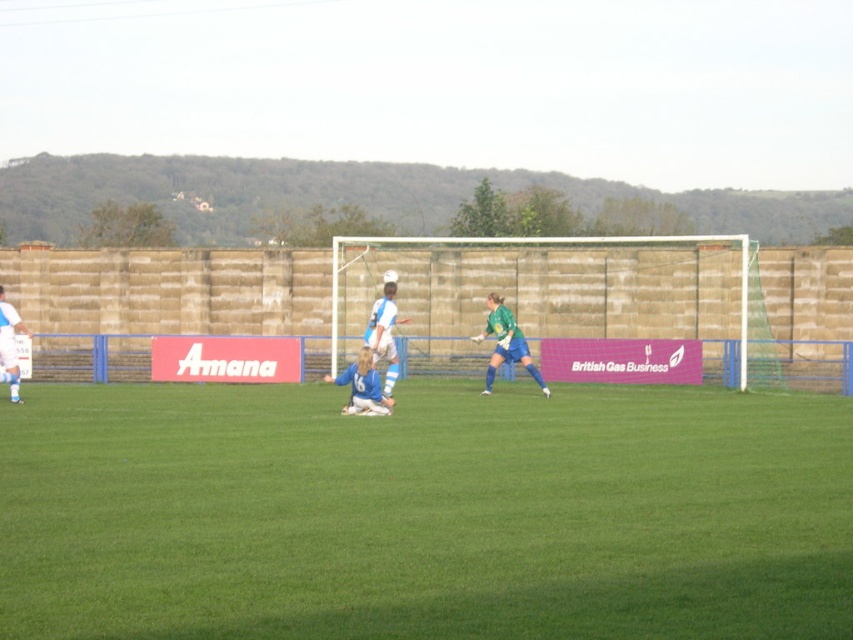
Question: Considering the relative positions of white net at center and white matte soccer ball at center in the image provided, where is white net at center located with respect to white matte soccer ball at center?

Choices:
 (A) above
 (B) below

Answer: (A)

Question: Among these objects, which one is nearest to the camera?

Choices:
 (A) white jersey at center
 (B) blue jersey at center
 (C) white net at center

Answer: (B)

Question: Considering the relative positions of green grass at center and white matte soccer ball at center in the image provided, where is green grass at center located with respect to white matte soccer ball at center?

Choices:
 (A) left
 (B) right

Answer: (B)

Question: Estimate the real-world distances between objects in this image. Which object is closer to the white net at center?

Choices:
 (A) green grass at center
 (B) white matte soccer ball at center
 (C) white jersey at center
 (D) blue jersey at center

Answer: (A)

Question: Which object is the closest to the white net at center?

Choices:
 (A) white matte soccer ball at center
 (B) green grass at center

Answer: (B)

Question: Can you confirm if green grass at center is wider than white net at center?

Choices:
 (A) no
 (B) yes

Answer: (B)